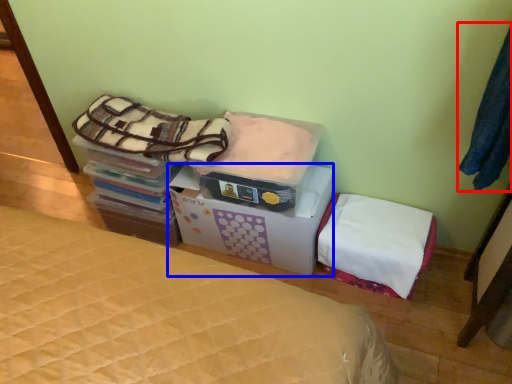
Question: Which object appears farthest to the camera in this image, clothing (highlighted by a red box) or cardboard box (highlighted by a blue box)?

Choices:
 (A) clothing
 (B) cardboard box

Answer: (B)